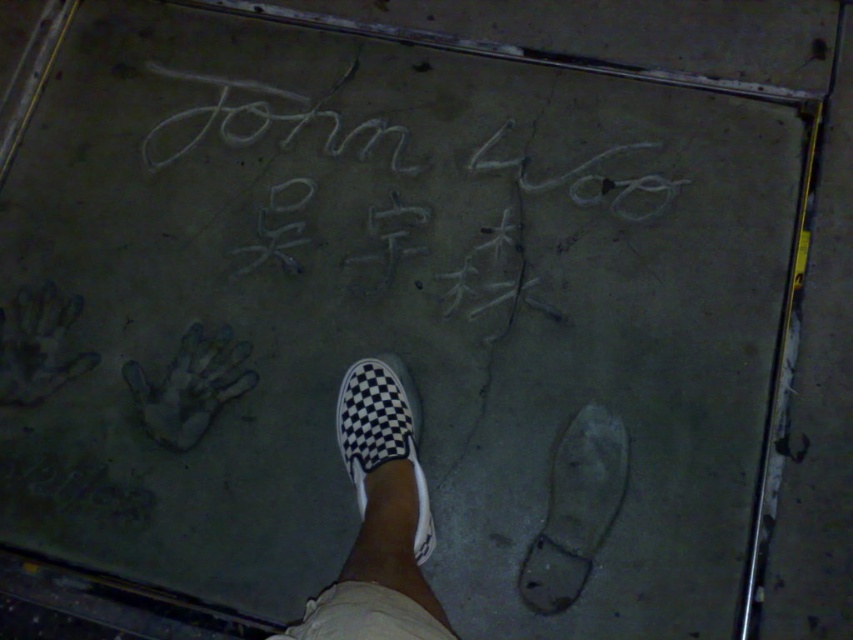
Can you confirm if black checkered slip-on shoe at center is positioned to the left of white chalk writing at center?

No, black checkered slip-on shoe at center is not to the left of white chalk writing at center.

Identify the location of black checkered slip-on shoe at center. (381, 509).

Between white rubber footprint at lower center and white chalk writing at center, which one has more height?

Standing taller between the two is white chalk writing at center.

Does point (549, 500) come behind point (209, 76)?

No.

Locate an element on the screen. white rubber footprint at lower center is located at coordinates (575, 509).

Is black checkered slip-on shoe at center bigger than white checkered slip-on at center?

Correct, black checkered slip-on shoe at center is larger in size than white checkered slip-on at center.

Between black checkered slip-on shoe at center and white checkered slip-on at center, which one has less height?

With less height is white checkered slip-on at center.

The image size is (853, 640). I want to click on black checkered slip-on shoe at center, so click(381, 509).